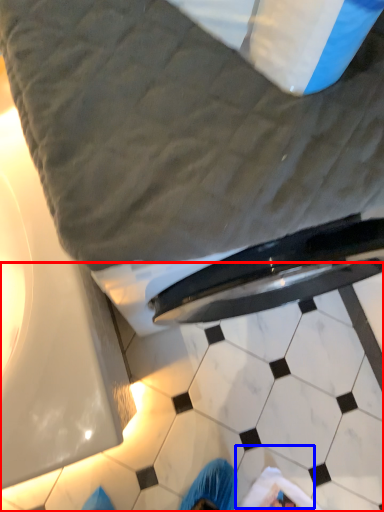
Question: Which object is further to the camera taking this photo, tile (highlighted by a red box) or tile (highlighted by a blue box)?

Choices:
 (A) tile
 (B) tile

Answer: (B)